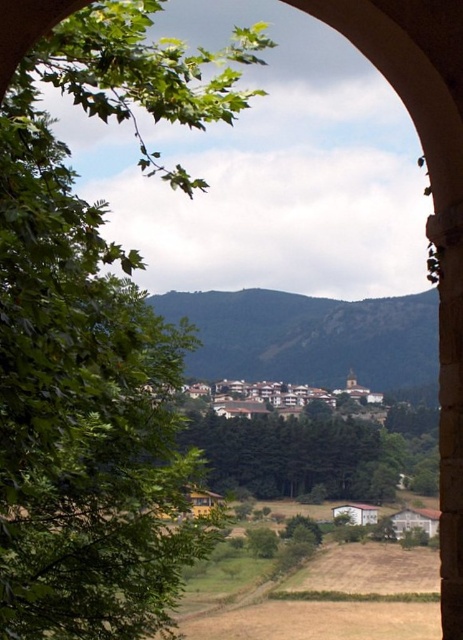
Question: From the image, what is the correct spatial relationship of green leafy tree at left in relation to green grassy hill at center?

Choices:
 (A) left
 (B) right

Answer: (A)

Question: Estimate the real-world distances between objects in this image. Which object is farther from the green grassy hill at center?

Choices:
 (A) green leafy tree at center
 (B) green leafy tree at left

Answer: (B)

Question: Does green leafy tree at left appear on the left side of green leafy tree at center?

Choices:
 (A) no
 (B) yes

Answer: (B)

Question: Which object is positioned farthest from the green grassy hill at center?

Choices:
 (A) green leafy tree at left
 (B) green leafy tree at center

Answer: (A)

Question: Can you confirm if green leafy tree at left is positioned above green grassy hill at center?

Choices:
 (A) yes
 (B) no

Answer: (A)

Question: Among these points, which one is farthest from the camera?

Choices:
 (A) (212, 346)
 (B) (207, 451)
 (C) (54, 353)

Answer: (A)